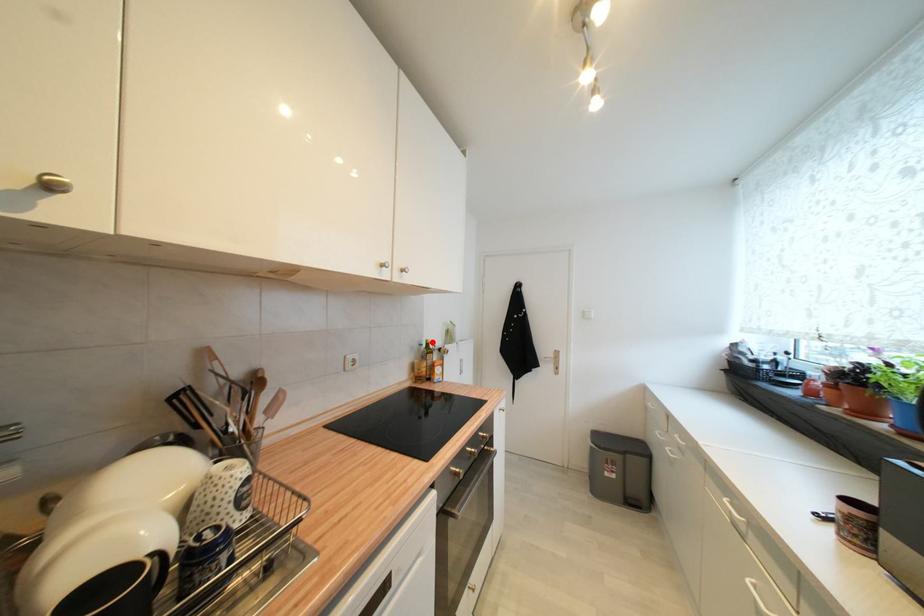
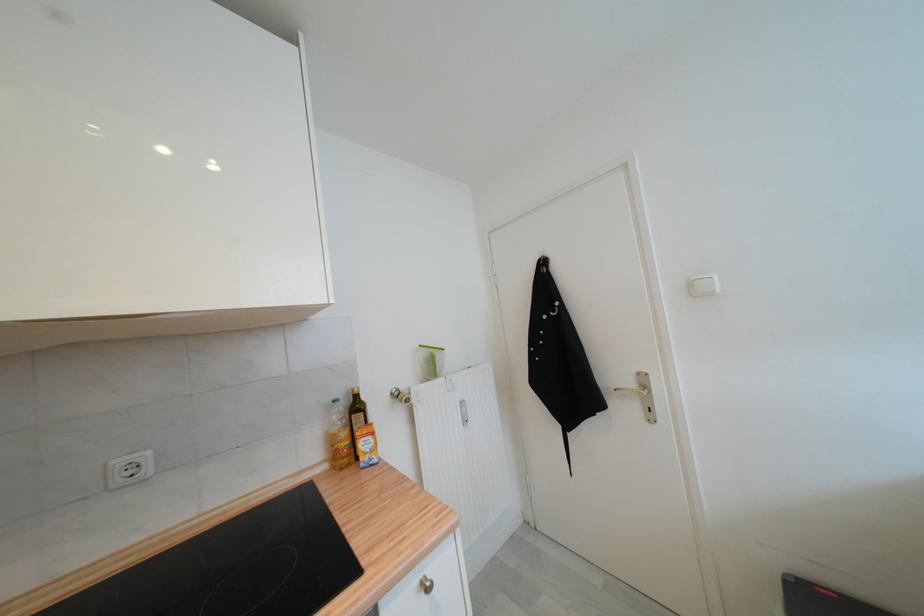
The point at the highlighted location is marked in the first image. Where is the corresponding point in the second image?

(358, 392)